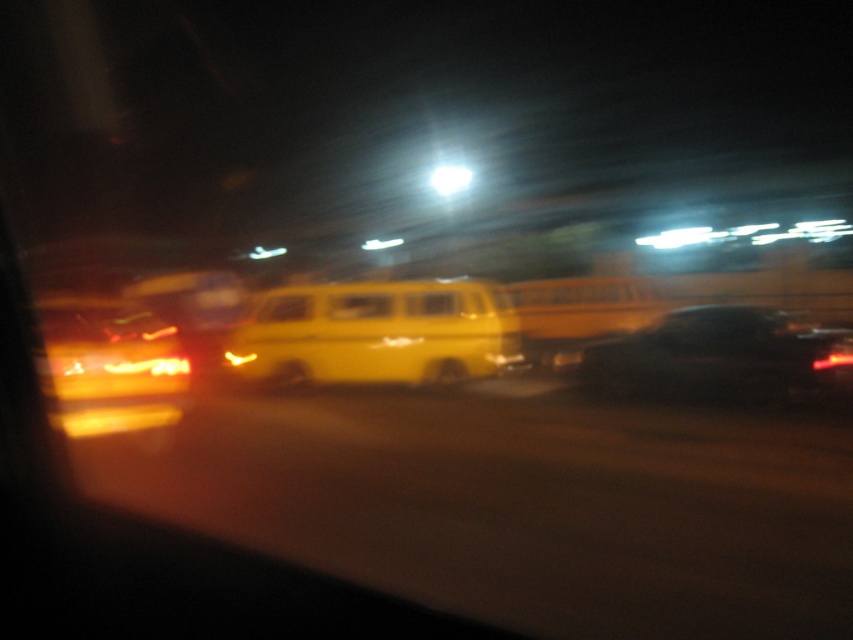
You are a driver trying to parallel park your car. You see a yellow matte van at center and a matte yellow van at center in the parking lot. Which one is shorter?

The yellow matte van at center is shorter than the matte yellow van at center.

You are driving a car that is 5 meters long. You want to park your car between the yellow matte van at center and the black glossy car at right. Is there enough space between them to park your car?

The yellow matte van at center is 7.63 meters from the black glossy car at right. Since your car is 5 meters long, there is enough space between them to park your car.